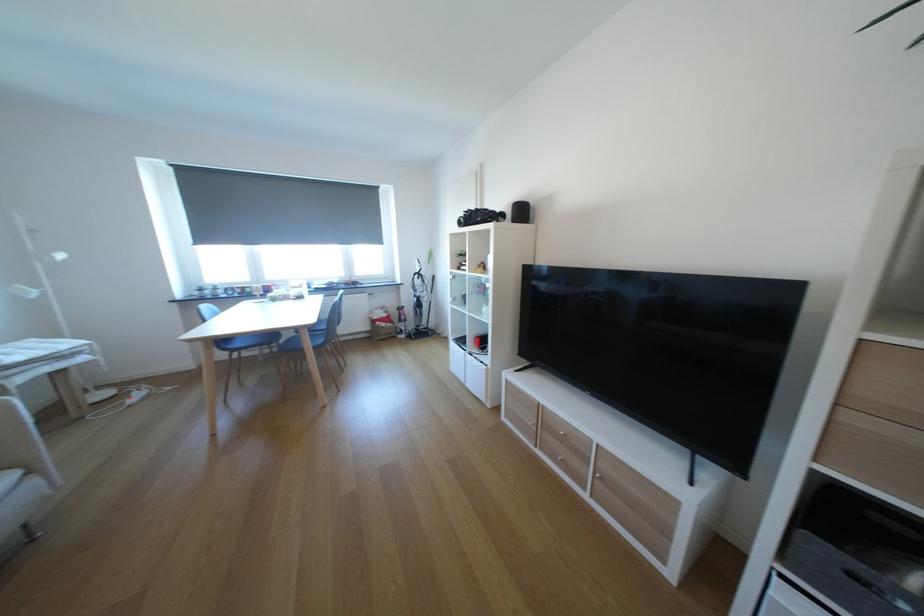
Identify the location of black speaker. The width and height of the screenshot is (924, 616). (520, 212).